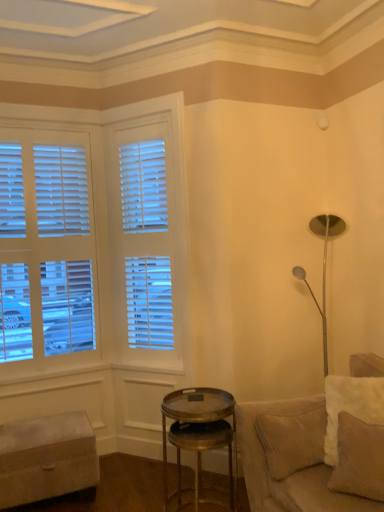
What is the approximate width of beige leather couch at lower right?

It is 3.61 feet.

What do you see at coordinates (200, 445) in the screenshot?
I see `gold metallic side table at center` at bounding box center [200, 445].

Find the location of `beige fabric pillow at lower right`. beige fabric pillow at lower right is located at coordinates (359, 459).

What are the coordinates of `beige leather couch at lower right` in the screenshot? It's located at (303, 458).

Would you say beige fabric ottoman at lower left contains beige leather couch at lower right?

No, beige leather couch at lower right is located outside of beige fabric ottoman at lower left.

This screenshot has width=384, height=512. Identify the location of bar stool directly beneath the beige leather couch at lower right (from a real-world perspective). (47, 458).

From the image's perspective, which one is positioned lower, beige fabric ottoman at lower left or beige leather couch at lower right?

beige fabric ottoman at lower left is shown below in the image.

Is beige leather couch at lower right at the back of beige fabric ottoman at lower left?

beige fabric ottoman at lower left does not have its back to beige leather couch at lower right.

Which object is further away from the camera, beige fabric pillow at lower right or beige leather couch at lower right?

beige fabric pillow at lower right is behind.

Between point (355, 432) and point (313, 443), which one is positioned in front?

The point (355, 432) is closer.

Would you say beige fabric pillow at lower right is to the left or to the right of beige leather couch at lower right in the picture?

beige fabric pillow at lower right is positioned on beige leather couch at lower right's left side.

From a real-world perspective, which object stands above the other?

In real-world perspective, beige fabric pillow at lower right is above.

Is gold metallic side table at center in front of or behind beige leather couch at lower right in the image?

gold metallic side table at center is behind beige leather couch at lower right.

Is point (200, 423) closer or farther from the camera than point (352, 362)?

Clearly, point (200, 423) is closer to the camera than point (352, 362).

From a real-world perspective, is gold metallic side table at center on top of beige leather couch at lower right?

Actually, gold metallic side table at center is physically below beige leather couch at lower right in the real world.

Between gold metallic side table at center and beige leather couch at lower right, which one has less height?

Standing shorter between the two is gold metallic side table at center.

Is there a large distance between beige fabric pillow at lower right and beige fabric ottoman at lower left?

Indeed, beige fabric pillow at lower right is not near beige fabric ottoman at lower left.

Considering the points (349, 454) and (53, 486), which point is behind, point (349, 454) or point (53, 486)?

Positioned behind is point (53, 486).

What's the angular difference between beige fabric pillow at lower right and beige fabric ottoman at lower left's facing directions?

52.1 degrees separate the facing orientations of beige fabric pillow at lower right and beige fabric ottoman at lower left.

Is beige fabric pillow at lower right to the right of beige fabric ottoman at lower left from the viewer's perspective?

Yes, beige fabric pillow at lower right is to the right of beige fabric ottoman at lower left.

Identify the location of table on the left side of beige leather couch at lower right. The height and width of the screenshot is (512, 384). (200, 445).

Choose the correct answer: Is beige leather couch at lower right inside gold metallic side table at center or outside it?

beige leather couch at lower right lies outside gold metallic side table at center.

Which of these two, beige leather couch at lower right or gold metallic side table at center, stands shorter?

gold metallic side table at center.

Considering the relative sizes of beige fabric ottoman at lower left and gold metallic side table at center in the image provided, is beige fabric ottoman at lower left thinner than gold metallic side table at center?

Incorrect, the width of beige fabric ottoman at lower left is not less than that of gold metallic side table at center.

Considering the sizes of objects beige fabric ottoman at lower left and gold metallic side table at center in the image provided, who is bigger, beige fabric ottoman at lower left or gold metallic side table at center?

Bigger between the two is beige fabric ottoman at lower left.

Is beige fabric pillow at lower right oriented towards gold metallic side table at center?

No, beige fabric pillow at lower right is not facing towards gold metallic side table at center.

From the image's perspective, between beige fabric pillow at lower right and gold metallic side table at center, which one is located above?

beige fabric pillow at lower right is shown above in the image.

Is beige fabric pillow at lower right at the right side of gold metallic side table at center?

Indeed, beige fabric pillow at lower right is positioned on the right side of gold metallic side table at center.

The image size is (384, 512). I want to click on studio couch located in front of the beige fabric ottoman at lower left, so click(303, 458).

Where is `pillow behind the beige leather couch at lower right`? This screenshot has width=384, height=512. pillow behind the beige leather couch at lower right is located at coordinates (359, 459).

In the scene shown: When comparing their distances from beige leather couch at lower right, does beige fabric ottoman at lower left or beige fabric pillow at lower right seem closer?

beige fabric pillow at lower right is positioned closer to the anchor beige leather couch at lower right.

Considering their positions, is gold metallic side table at center positioned further to beige fabric pillow at lower right than beige fabric ottoman at lower left?

beige fabric ottoman at lower left is positioned further to the anchor beige fabric pillow at lower right.

Considering their positions, is beige leather couch at lower right positioned closer to gold metallic side table at center than beige fabric pillow at lower right?

beige leather couch at lower right is closer to gold metallic side table at center.

Considering their positions, is gold metallic side table at center positioned further to beige fabric ottoman at lower left than beige fabric pillow at lower right?

Based on the image, beige fabric pillow at lower right appears to be further to beige fabric ottoman at lower left.

Looking at the image, which one is located further to beige leather couch at lower right, beige fabric pillow at lower right or gold metallic side table at center?

The object further to beige leather couch at lower right is gold metallic side table at center.

Based on their spatial positions, is gold metallic side table at center or beige fabric ottoman at lower left further from beige leather couch at lower right?

Based on the image, beige fabric ottoman at lower left appears to be further to beige leather couch at lower right.

Considering their positions, is beige fabric pillow at lower right positioned closer to gold metallic side table at center than beige leather couch at lower right?

beige leather couch at lower right is closer to gold metallic side table at center.

Based on their spatial positions, is beige fabric ottoman at lower left or beige leather couch at lower right closer to gold metallic side table at center?

beige leather couch at lower right is positioned closer to the anchor gold metallic side table at center.

What are the coordinates of `table situated between beige fabric ottoman at lower left and beige leather couch at lower right from left to right` in the screenshot? It's located at (200, 445).

The width and height of the screenshot is (384, 512). I want to click on table between beige fabric ottoman at lower left and beige fabric pillow at lower right in the horizontal direction, so click(200, 445).

Identify the location of pillow between beige fabric ottoman at lower left and beige leather couch at lower right in the horizontal direction. (359, 459).

I want to click on pillow between beige leather couch at lower right and gold metallic side table at center from front to back, so click(359, 459).